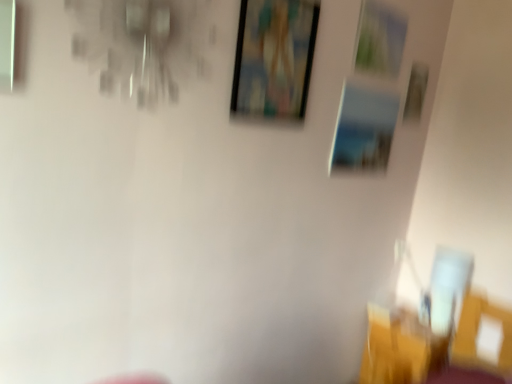
Question: Is metallic silver picture frame at upper right, the second picture frame viewed from the right, in front of wooden picture frame at upper right, the 1th picture frame positioned from the right?

Choices:
 (A) yes
 (B) no

Answer: (A)

Question: Is metallic silver picture frame at upper right, the second picture frame viewed from the right, thinner than wooden picture frame at upper right, which is counted as the fourth picture frame, starting from the left?

Choices:
 (A) yes
 (B) no

Answer: (A)

Question: Are metallic silver picture frame at upper right, the third picture frame in the left-to-right sequence, and wooden picture frame at upper right, the 1th picture frame positioned from the right, making contact?

Choices:
 (A) yes
 (B) no

Answer: (B)

Question: Is metallic silver picture frame at upper right, the third picture frame in the left-to-right sequence, taller than wooden picture frame at upper right, which is counted as the fourth picture frame, starting from the left?

Choices:
 (A) yes
 (B) no

Answer: (B)

Question: Is metallic silver picture frame at upper right, the third picture frame in the left-to-right sequence, oriented towards wooden picture frame at upper right, which is counted as the fourth picture frame, starting from the left?

Choices:
 (A) no
 (B) yes

Answer: (A)

Question: From the image's perspective, is metallic silver picture frame at upper right, the second picture frame viewed from the right, located beneath wooden picture frame at upper right, which is counted as the fourth picture frame, starting from the left?

Choices:
 (A) no
 (B) yes

Answer: (A)

Question: Considering the relative sizes of wooden picture frame at upper right, the 1th picture frame positioned from the right, and wooden picture frame at upper center, which is the first picture frame in left-to-right order, in the image provided, is wooden picture frame at upper right, the 1th picture frame positioned from the right, smaller than wooden picture frame at upper center, which is the first picture frame in left-to-right order,?

Choices:
 (A) no
 (B) yes

Answer: (B)

Question: From a real-world perspective, is wooden picture frame at upper right, which is counted as the fourth picture frame, starting from the left, positioned over wooden picture frame at upper center, which is the first picture frame in left-to-right order, based on gravity?

Choices:
 (A) yes
 (B) no

Answer: (B)

Question: Are wooden picture frame at upper right, which is counted as the fourth picture frame, starting from the left, and wooden picture frame at upper center, the 4th picture frame from the right, far apart?

Choices:
 (A) no
 (B) yes

Answer: (B)

Question: From the image's perspective, is wooden picture frame at upper right, which is counted as the fourth picture frame, starting from the left, located above wooden picture frame at upper center, the 4th picture frame from the right?

Choices:
 (A) yes
 (B) no

Answer: (A)

Question: Is the depth of wooden picture frame at upper right, the 1th picture frame positioned from the right, greater than that of wooden picture frame at upper center, which is the first picture frame in left-to-right order?

Choices:
 (A) yes
 (B) no

Answer: (A)

Question: Does wooden picture frame at upper right, the 1th picture frame positioned from the right, have a larger size compared to wooden picture frame at upper center, which is the first picture frame in left-to-right order?

Choices:
 (A) no
 (B) yes

Answer: (A)

Question: From the image's perspective, is yellow fabric chair at lower right above wooden picture frame at upper center, which is the first picture frame in left-to-right order?

Choices:
 (A) no
 (B) yes

Answer: (A)